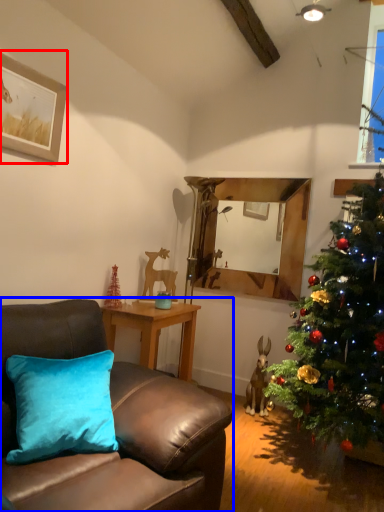
Question: Which of the following is the farthest to the observer, picture frame (highlighted by a red box) or studio couch (highlighted by a blue box)?

Choices:
 (A) picture frame
 (B) studio couch

Answer: (A)